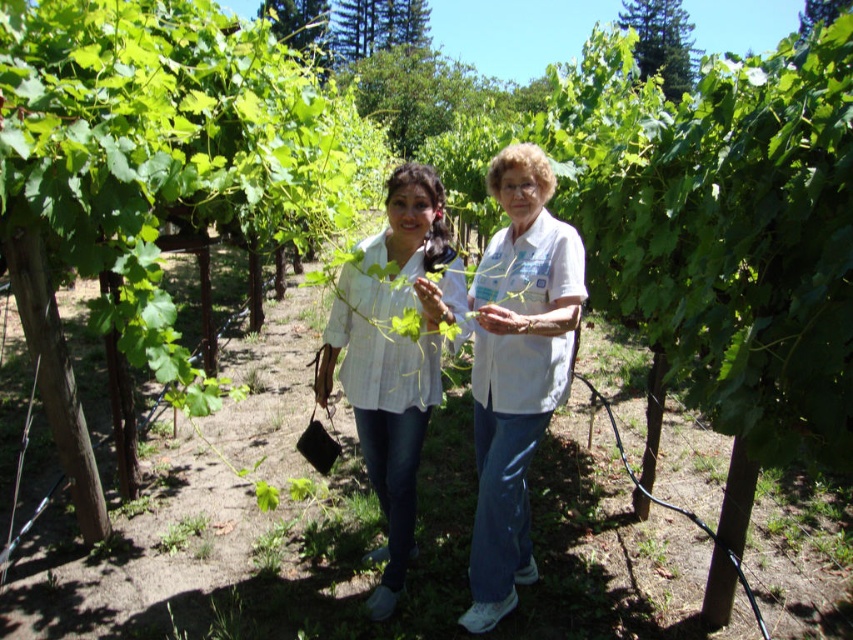
Does white cotton shirt at center appear over white matte shirt at center?

Yes, white cotton shirt at center is above white matte shirt at center.

Which is more to the left, white cotton shirt at center or white matte shirt at center?

Positioned to the left is white matte shirt at center.

Image resolution: width=853 pixels, height=640 pixels. I want to click on white cotton shirt at center, so click(x=515, y=369).